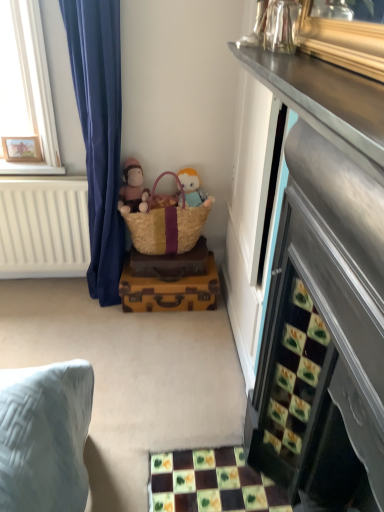
Locate an element on the screen. Image resolution: width=384 pixels, height=512 pixels. vintage brown suitcase at center is located at coordinates (169, 290).

Measure the distance between point (x=149, y=309) and camera.

Point (x=149, y=309) and camera are 2.21 meters apart from each other.

What do you see at coordinates (193, 189) in the screenshot? The image size is (384, 512). I see `soft plush toy at center` at bounding box center [193, 189].

This screenshot has width=384, height=512. Find the location of `soft plush toy at center`. soft plush toy at center is located at coordinates point(193,189).

The image size is (384, 512). I want to click on brown woven picnic basket at center, so click(x=164, y=224).

Can we say vintage brown suitcase at center lies outside soft brown plush at lower center?

Yes, vintage brown suitcase at center is located beyond the bounds of soft brown plush at lower center.

Does vintage brown suitcase at center appear on the left side of soft brown plush at lower center?

In fact, vintage brown suitcase at center is to the right of soft brown plush at lower center.

Can you tell me how much vintage brown suitcase at center and soft brown plush at lower center differ in facing direction?

They differ by 0.000964 degrees in their facing directions.

Is there a large distance between brown woven picnic basket at center and soft plush toy at center?

brown woven picnic basket at center is actually quite close to soft plush toy at center.

How many degrees apart are the facing directions of brown woven picnic basket at center and soft plush toy at center?

0.0013 degrees.

This screenshot has height=512, width=384. In order to click on toy that is on the right side of brown woven picnic basket at center in this screenshot , I will do `click(193, 189)`.

Is soft plush toy at center at the back of brown woven picnic basket at center?

A: Yes.

How different are the orientations of brown woven picnic basket at center and soft brown plush at lower center in degrees?

The angle between the facing direction of brown woven picnic basket at center and the facing direction of soft brown plush at lower center is 0.00116 degrees.

Which object is positioned more to the right, brown woven picnic basket at center or soft brown plush at lower center?

brown woven picnic basket at center is more to the right.

Who is shorter, brown woven picnic basket at center or soft brown plush at lower center?

soft brown plush at lower center is shorter.

Looking at this image, is vintage brown suitcase at center far away from brown woven picnic basket at center?

vintage brown suitcase at center is near brown woven picnic basket at center, not far away.

Considering the sizes of objects vintage brown suitcase at center and brown woven picnic basket at center in the image provided, who is wider, vintage brown suitcase at center or brown woven picnic basket at center?

vintage brown suitcase at center is wider.

Is vintage brown suitcase at center not within brown woven picnic basket at center?

Yes, vintage brown suitcase at center is not within brown woven picnic basket at center.

In the scene shown: Does vintage brown suitcase at center come behind brown woven picnic basket at center?

Yes, vintage brown suitcase at center is further from the camera.

Is soft brown plush at lower center inside or outside of soft plush toy at center?

soft brown plush at lower center is located beyond the bounds of soft plush toy at center.

From a real-world perspective, who is located lower, soft brown plush at lower center or soft plush toy at center?

From a 3D spatial view, soft plush toy at center is below.

Considering the points (142, 211) and (183, 175), which point is in front, point (142, 211) or point (183, 175)?

Positioned in front is point (142, 211).

Which of these two, soft brown plush at lower center or soft plush toy at center, stands shorter?

soft brown plush at lower center.

Consider the image. What's the angular difference between soft brown plush at lower center and brown woven picnic basket at center's facing directions?

The facing directions of soft brown plush at lower center and brown woven picnic basket at center are 0.00116 degrees apart.

Who is taller, soft brown plush at lower center or brown woven picnic basket at center?

Standing taller between the two is brown woven picnic basket at center.

Which is farther from the camera, (134, 192) or (176, 207)?

Positioned behind is point (134, 192).

From the image's perspective, which one is positioned higher, soft brown plush at lower center or brown woven picnic basket at center?

soft brown plush at lower center, from the image's perspective.

I want to click on toy on the right side of vintage brown suitcase at center, so click(x=193, y=189).

From a real-world perspective, is vintage brown suitcase at center on top of soft plush toy at center?

No, from a real-world perspective, vintage brown suitcase at center is not over soft plush toy at center

Is vintage brown suitcase at center aimed at soft plush toy at center?

No, vintage brown suitcase at center does not turn towards soft plush toy at center.

Is vintage brown suitcase at center at the right side of soft plush toy at center?

In fact, vintage brown suitcase at center is to the left of soft plush toy at center.

Locate an element on the screen. The image size is (384, 512). luggage below the soft brown plush at lower center (from the image's perspective) is located at coordinates (169, 290).

This screenshot has height=512, width=384. What are the coordinates of `picnic basket in front of the soft plush toy at center` in the screenshot? It's located at (164, 224).

When comparing their distances from brown woven picnic basket at center, does soft plush toy at center or vintage brown suitcase at center seem further?

vintage brown suitcase at center is further to brown woven picnic basket at center.

Based on their spatial positions, is soft brown plush at lower center or brown woven picnic basket at center further from vintage brown suitcase at center?

The object further to vintage brown suitcase at center is soft brown plush at lower center.

Which object lies nearer to the anchor point soft brown plush at lower center, brown woven picnic basket at center or soft plush toy at center?

The object closer to soft brown plush at lower center is brown woven picnic basket at center.

Looking at the image, which one is located closer to soft plush toy at center, soft brown plush at lower center or brown woven picnic basket at center?

The object closer to soft plush toy at center is brown woven picnic basket at center.

Considering their positions, is brown woven picnic basket at center positioned closer to vintage brown suitcase at center than soft brown plush at lower center?

Among the two, brown woven picnic basket at center is located nearer to vintage brown suitcase at center.

From the image, which object appears to be nearer to soft plush toy at center, vintage brown suitcase at center or soft brown plush at lower center?

The object closer to soft plush toy at center is soft brown plush at lower center.

From the image, which object appears to be farther from brown woven picnic basket at center, soft brown plush at lower center or vintage brown suitcase at center?

Based on the image, vintage brown suitcase at center appears to be further to brown woven picnic basket at center.

From the image, which object appears to be farther from soft plush toy at center, vintage brown suitcase at center or brown woven picnic basket at center?

vintage brown suitcase at center.

This screenshot has height=512, width=384. What are the coordinates of `picnic basket between soft brown plush at lower center and vintage brown suitcase at center from top to bottom` in the screenshot? It's located at (164, 224).

I want to click on picnic basket between soft brown plush at lower center and soft plush toy at center, so click(164, 224).

The height and width of the screenshot is (512, 384). Identify the location of toy between soft brown plush at lower center and vintage brown suitcase at center from top to bottom. 193,189.

Find the location of a particular element. picnic basket between soft plush toy at center and vintage brown suitcase at center in the up-down direction is located at coordinates (164, 224).